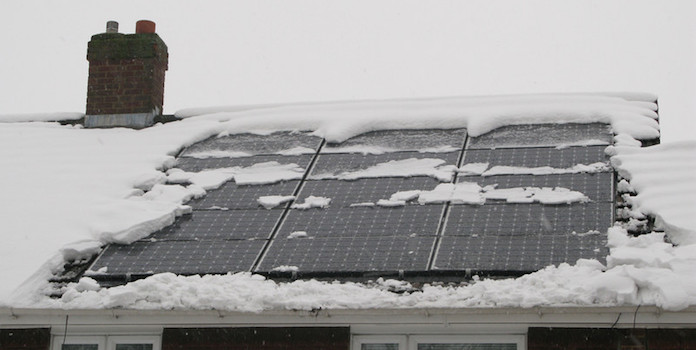
This screenshot has width=696, height=350. What are the coordinates of `1 chimney` in the screenshot? It's located at (118, 64).